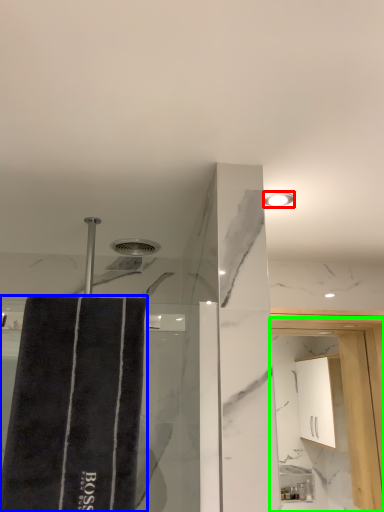
Question: Estimate the real-world distances between objects in this image. Which object is farther from light fixture (highlighted by a red box), bath towel (highlighted by a blue box) or screen door (highlighted by a green box)?

Choices:
 (A) bath towel
 (B) screen door

Answer: (B)